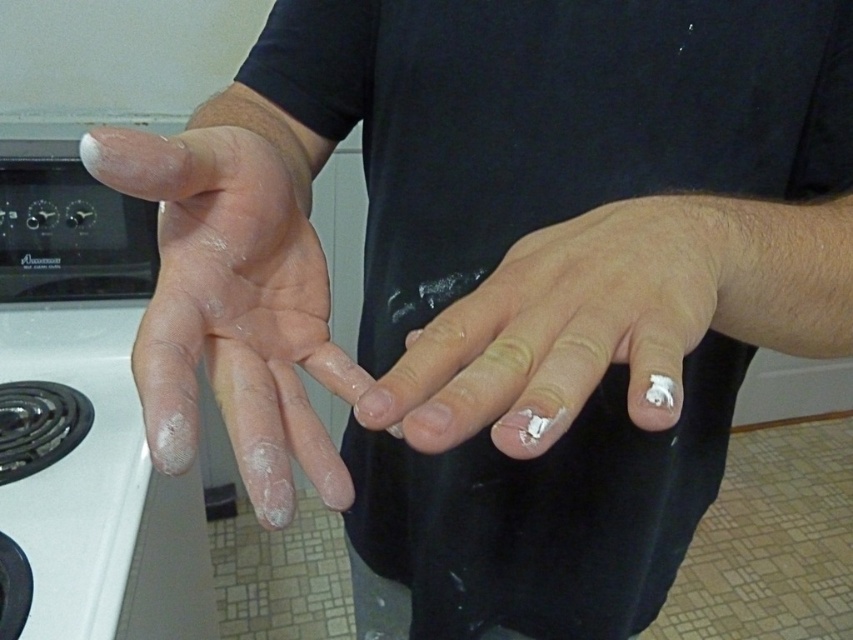
You are a chef preparing to bake a cake. You notice your hands are covered in flour. Looking at the white matte hand at center and the white matte nails at center, which part of your hand is larger in size?

The white matte hand at center is much taller than the white matte nails at center, so the hand part is larger in size.

You are a delivery person who needs to place a small package on the floor near the stovetop. The package must be placed exactly at the point labeled as point (183,184). However, you can only reach 10 inches from your current position. Can you reach that point?

The point (183,184) is 12.08 inches away from the viewer, which is beyond the delivery person can reach from their current position. Therefore, they cannot place the package there without moving closer.